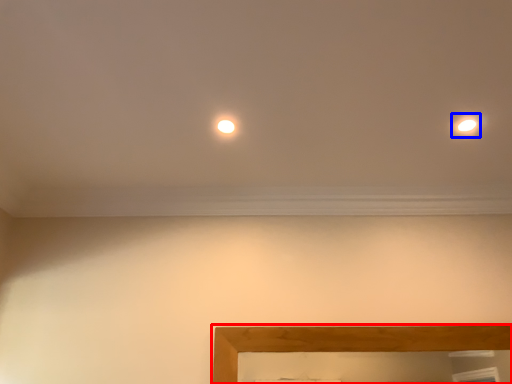
Question: Which of the following is the farthest to the observer, picture frame (highlighted by a red box) or light (highlighted by a blue box)?

Choices:
 (A) picture frame
 (B) light

Answer: (A)